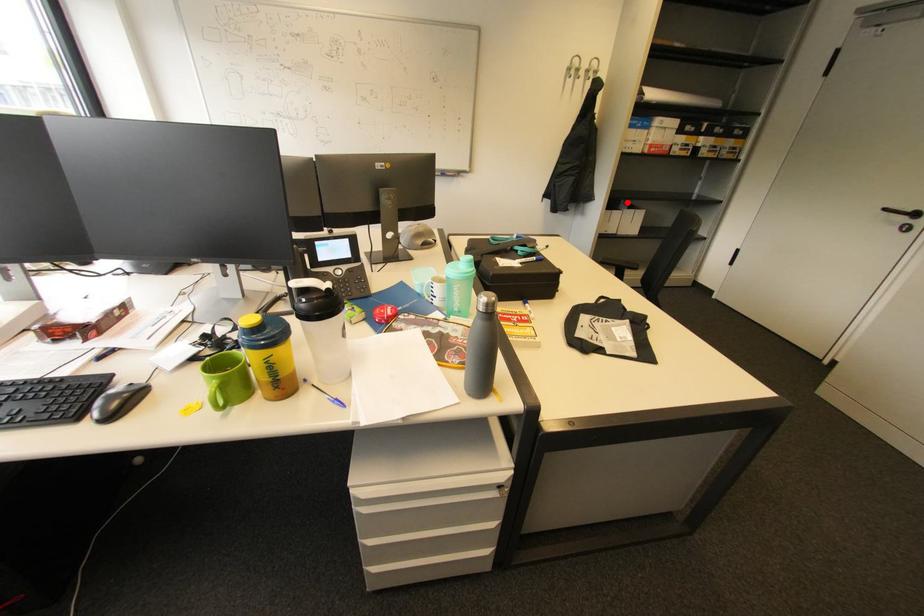
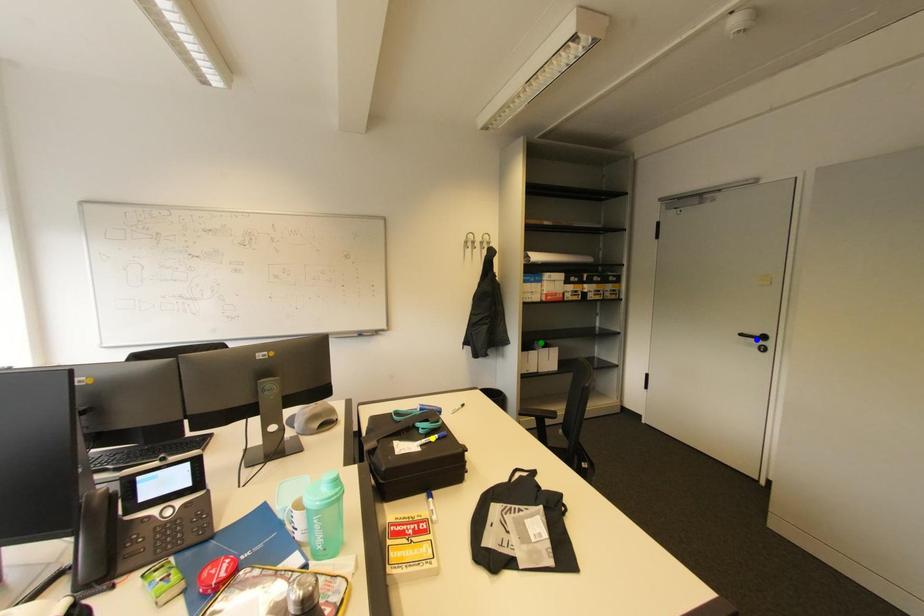
Question: I am providing you with two images of the same scene from different viewpoints. A red point is marked on the first image. You are given multiple points on the second image. Which mark in image 2 goes with the point in image 1?

Choices:
 (A) green point
 (B) blue point
 (C) yellow point

Answer: (A)